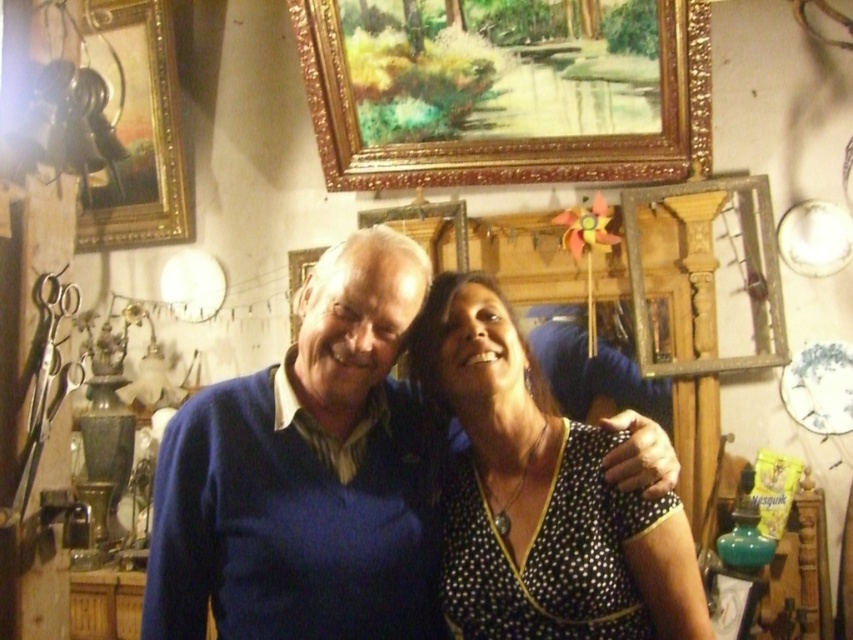
You are an interior designer assessing the wall space in this room. You need to hang a new decorative item that requires a width of at least 15 inches. Based on the existing frames, which one between the gold ornate picture frame at upper center and the goldmetallicpicture frame at upper left would you consider for potential removal to accommodate the new item, assuming their widths are as described?

The gold ornate picture frame at upper center might be wider than the goldmetallicpicture frame at upper left, so it could be a better candidate for removal to make space for the new item requiring 15 inches of width.

You are standing in the room and want to locate the blue matte sweater at center. According to the coordinates provided, where should you look to find it?

The blue matte sweater at center is located at the 2D coordinates point (306, 476).

Consider the image. You are an interior designer assessing the space for a new wall art installation. The gold ornate picture frame at upper center and the black dotted dress at center are both in your line of sight. Can you determine which object is wider?

The gold ornate picture frame at upper center is wider than the black dotted dress at center.